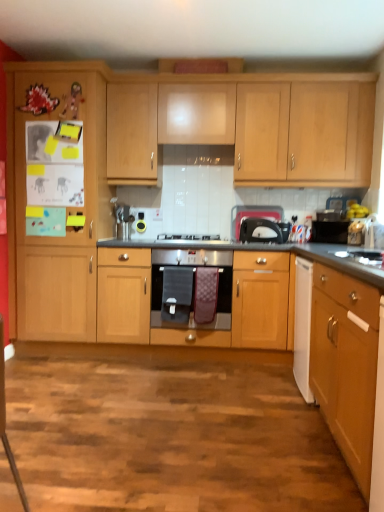
Question: In terms of size, does satin silver gas stove at center appear bigger or smaller than light wood cabinet at upper center, which appears as the 1th cabinetry when viewed from the back?

Choices:
 (A) big
 (B) small

Answer: (B)

Question: From a real-world perspective, is satin silver gas stove at center above or below light wood cabinet at upper center, which appears as the 1th cabinetry when viewed from the back?

Choices:
 (A) above
 (B) below

Answer: (B)

Question: Which object is the farthest from the light wood cabinet at upper center, which appears as the 1th cabinetry when viewed from the back?

Choices:
 (A) wooden cabinet at lower right, the 4th cabinetry when ordered from back to front
 (B) matte black toaster at center
 (C) wooden cabinet at left, the 2th cabinetry in the back-to-front sequence
 (D) satin silver gas stove at center
 (E) stainless steel oven at center

Answer: (A)

Question: Estimate the real-world distances between objects in this image. Which object is farther from the wooden cabinet at left, which is counted as the third cabinetry, starting from the front?

Choices:
 (A) stainless steel oven at center
 (B) wooden cabinet at center, acting as the 3th cabinetry starting from the back
 (C) light wood cabinet at upper center, the 4th cabinetry positioned from the front
 (D) wooden cabinet at lower right, the 4th cabinetry when ordered from back to front
 (E) satin silver gas stove at center

Answer: (D)